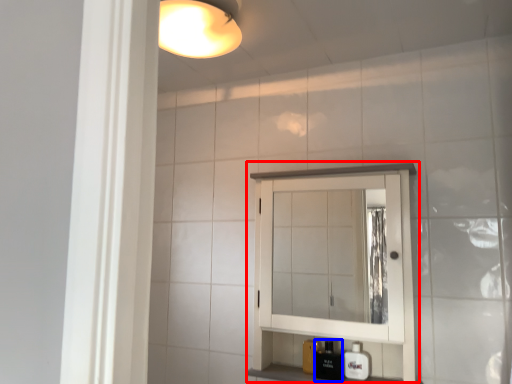
Question: Which of the following is the farthest to the observer, medicine cabinet (highlighted by a red box) or toiletry (highlighted by a blue box)?

Choices:
 (A) medicine cabinet
 (B) toiletry

Answer: (B)